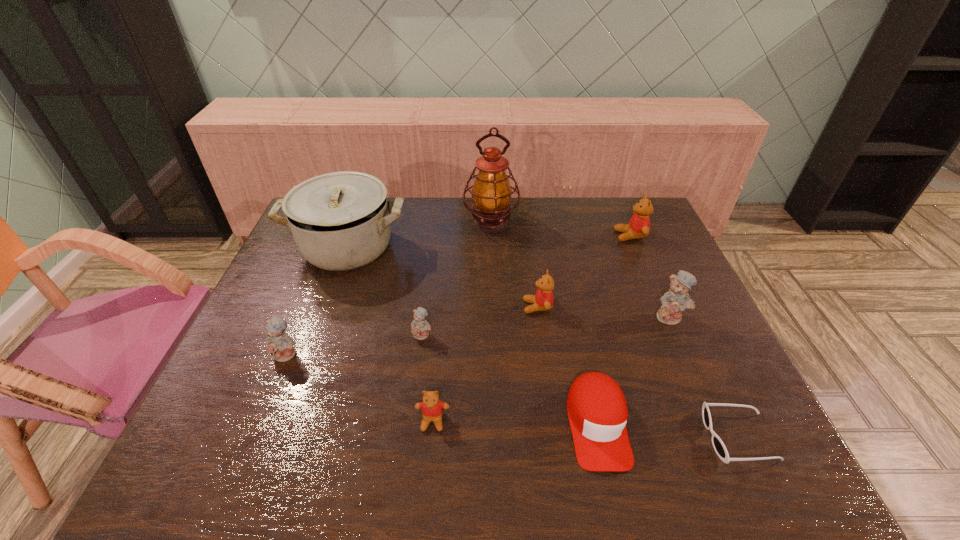
Identify the location of teddy bear that is the fifth closest to the fourth nearest object. (638, 227).

You are a GUI agent. You are given a task and a screenshot of the screen. Output one action in this format:
    pyautogui.click(x=<x>, y=<y>)
    Task: Click on the third closest blue teddy bear to the second red teddy bear from left to right
    This screenshot has width=960, height=540.
    Given the screenshot: What is the action you would take?
    pyautogui.click(x=278, y=344)

Where is `blue teddy bear that is the third closest one to the white saucepan`? blue teddy bear that is the third closest one to the white saucepan is located at coordinates (676, 300).

Locate an element on the screen. The width and height of the screenshot is (960, 540). red teddy bear that is the closest to the second farthest red teddy bear is located at coordinates (432, 408).

At what (x,y) coordinates should I click in order to perform the action: click on red teddy bear that stands as the closest to the rightmost red teddy bear. Please return your answer as a coordinate pair (x, y). This screenshot has width=960, height=540. Looking at the image, I should click on (543, 299).